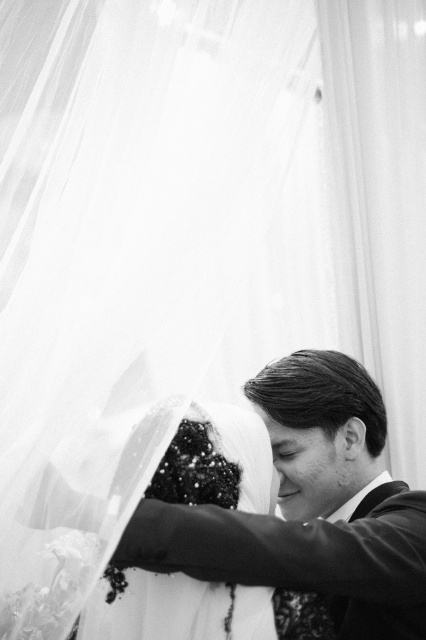
You are a photographer at a wedding. You need to adjust the lighting to ensure the smooth black suit at center and the sequined fabric veil at center are both well lit. Which object should you focus the light on first to ensure proper exposure?

The smooth black suit at center is in front of the sequined fabric veil at center, so you should focus the light on the smooth black suit at center first to ensure it is properly exposed before adjusting for the veil behind it.

You are a photographer at a wedding. You need to adjust the lighting to ensure both the smooth black suit at center and the sequined fabric veil at center are well lit. Which object should you focus on first to ensure proper exposure?

The sequined fabric veil at center should be focused on first because it is above the smooth black suit at center and might be more reflective, requiring careful lighting to avoid overexposure.

Based on the scene described, which object is wider when viewed from the front? Please choose between the smooth black suit at center and the sequined fabric veil at center.

The smooth black suit at center is wider than the sequined fabric veil at center.